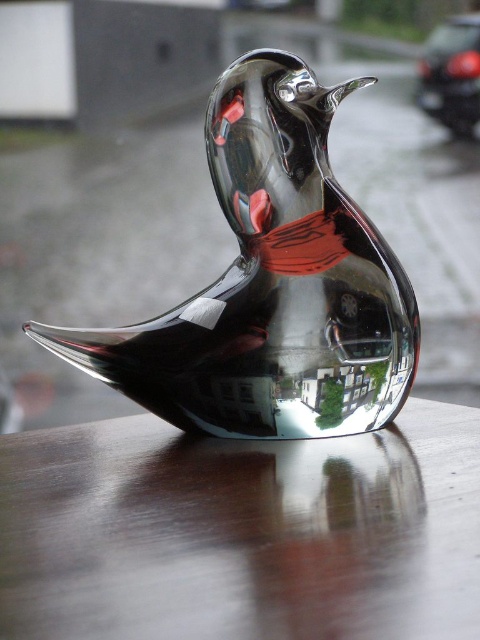
Can you confirm if glossy wood table at center is bigger than shiny metallic bird at center?

Yes, glossy wood table at center is bigger than shiny metallic bird at center.

Is glossy wood table at center to the right of shiny metallic bird at center from the viewer's perspective?

Correct, you'll find glossy wood table at center to the right of shiny metallic bird at center.

Is point (417, 433) less distant than point (368, 403)?

No, it is not.

The height and width of the screenshot is (640, 480). In order to click on glossy wood table at center in this screenshot , I will do `click(241, 532)`.